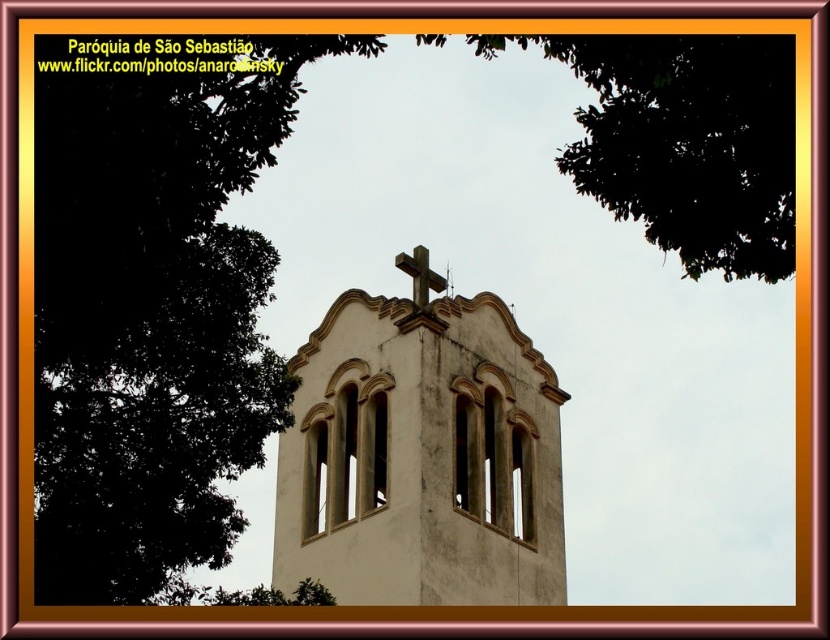
You are standing in front of the Paroque de Sao Sebastiao church tower. There is a point marked at coordinates (421, 458). What does this point indicate?

The point at coordinates (421, 458) indicates the white textured tower at center.

You are standing in front of the Paroque de Sao Sebastiao and want to take a photo of both the white textured tower at center and the rustic wooden cross at center. Based on their positions, which one should you pan your camera to first to ensure both are in frame?

You should pan your camera to the white textured tower at center first because it is positioned to the left of the rustic wooden cross at center, so capturing the left side first ensures both are included in the frame.

You are a photographer planning to capture the Par?quia de S?o Sebasti?o church tower. You notice the white textured tower at center and the rustic wooden cross at center. Which object should you focus on if you want to highlight the larger structure in your photo?

The white textured tower at center is bigger than the rustic wooden cross at center, so focusing on the white textured tower at center will highlight the larger structure in your photo.